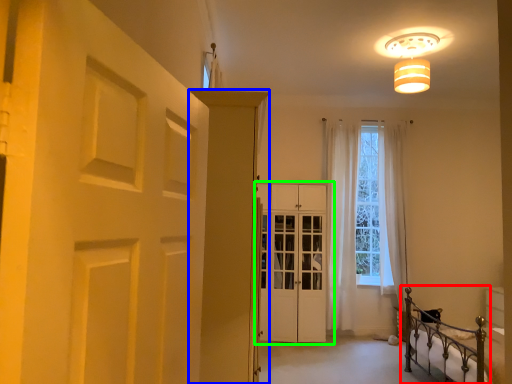
Question: Which object is the closest to the bed (highlighted by a red box)? Choose among these: door (highlighted by a blue box) or door (highlighted by a green box).

Choices:
 (A) door
 (B) door

Answer: (B)